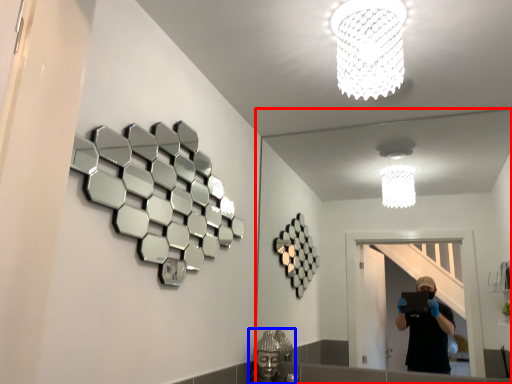
Question: Which point is closer to the camera, mirror (highlighted by a red box) or reflection (highlighted by a blue box)?

Choices:
 (A) mirror
 (B) reflection

Answer: (A)